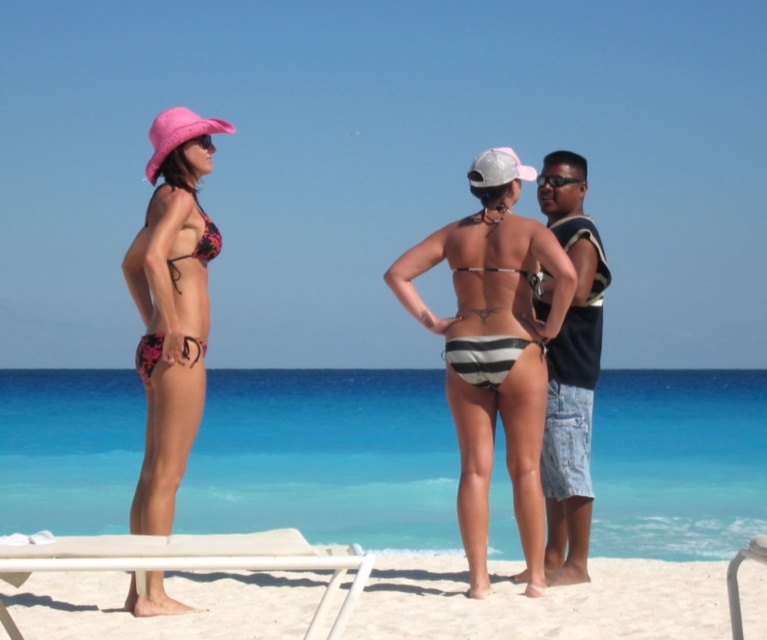
You are a photographer trying to capture a photo of the white sand at lower center and the white plastic beach chair at lower right. From the current position, can you see both objects in the frame without moving your camera?

The white plastic beach chair at lower right is behind the white sand at lower center, so it might be partially or fully obscured depending on their positions. To ensure both are visible, you may need to adjust your angle or move closer.

You are a beachgoer who wants to place a 6.5 feet long beach umbrella between the white sand at lower center and the white plastic beach chair at lower right. Can you fit it there without overlapping either object?

The distance between the white sand at lower center and the white plastic beach chair at lower right is 7.30 feet. Since the beach umbrella is 6.5 feet long, it can be placed between them without overlapping either object as there is sufficient space.